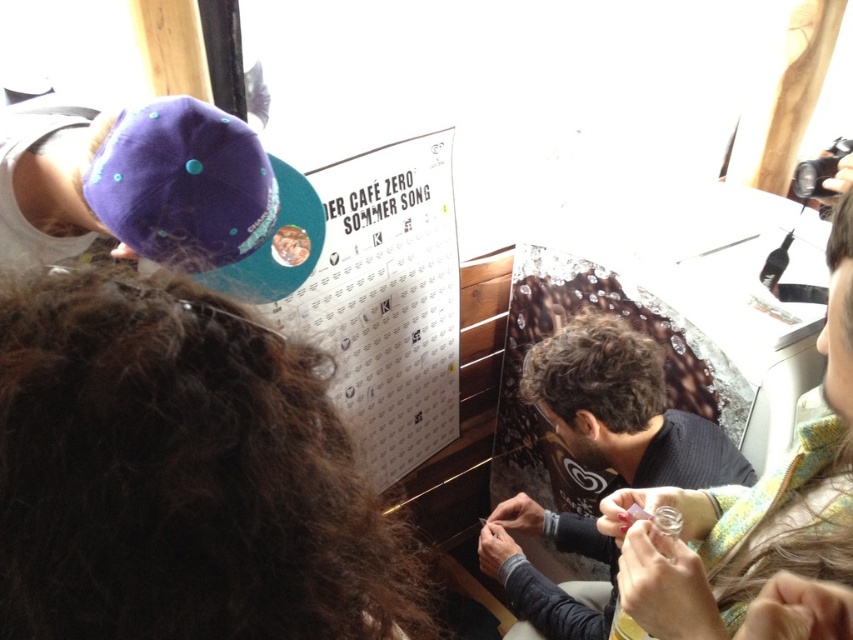
Does brown fuzzy hair at upper left have a lesser height compared to green fabric scarf at lower right?

Correct, brown fuzzy hair at upper left is not as tall as green fabric scarf at lower right.

Can you confirm if brown fuzzy hair at upper left is thinner than green fabric scarf at lower right?

Indeed, brown fuzzy hair at upper left has a lesser width compared to green fabric scarf at lower right.

Does point (88, 346) lie behind point (844, 256)?

That is False.

This screenshot has width=853, height=640. What are the coordinates of `brown fuzzy hair at upper left` in the screenshot? It's located at (181, 476).

In the scene shown: Does brown fuzzy hair at upper left have a lesser width compared to dark gray sweater at center?

Correct, brown fuzzy hair at upper left's width is less than dark gray sweater at center's.

Is the position of brown fuzzy hair at upper left more distant than that of dark gray sweater at center?

No, it is in front of dark gray sweater at center.

Which is behind, point (164, 480) or point (502, 566)?

The point (502, 566) is behind.

Where is `brown fuzzy hair at upper left`? The height and width of the screenshot is (640, 853). brown fuzzy hair at upper left is located at coordinates (181, 476).

Is green fabric scarf at lower right below dark gray sweater at center?

Actually, green fabric scarf at lower right is above dark gray sweater at center.

Which is behind, point (628, 493) or point (646, 410)?

The point (646, 410) is more distant.

Where is `green fabric scarf at lower right`? The height and width of the screenshot is (640, 853). green fabric scarf at lower right is located at coordinates (751, 504).